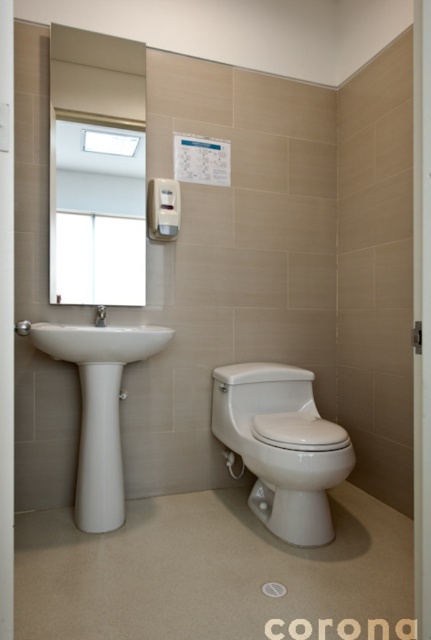
Question: Which of the following is the closest to the observer?

Choices:
 (A) (84, 326)
 (B) (28, 326)
 (C) (252, 458)
 (D) (103, 307)

Answer: (B)

Question: Is white glossy toilet at lower right to the left of white glossy faucet at left from the viewer's perspective?

Choices:
 (A) no
 (B) yes

Answer: (A)

Question: Among these points, which one is nearest to the camera?

Choices:
 (A) (152, 342)
 (B) (28, 321)
 (C) (103, 317)

Answer: (B)

Question: Does white glossy sink at left have a larger size compared to matte white shower at lower left?

Choices:
 (A) yes
 (B) no

Answer: (A)

Question: Does white glossy sink at left appear on the right side of matte white shower at lower left?

Choices:
 (A) yes
 (B) no

Answer: (A)

Question: Among these objects, which one is farthest from the camera?

Choices:
 (A) white glossy faucet at left
 (B) white glossy toilet at lower right
 (C) matte white shower at lower left

Answer: (A)